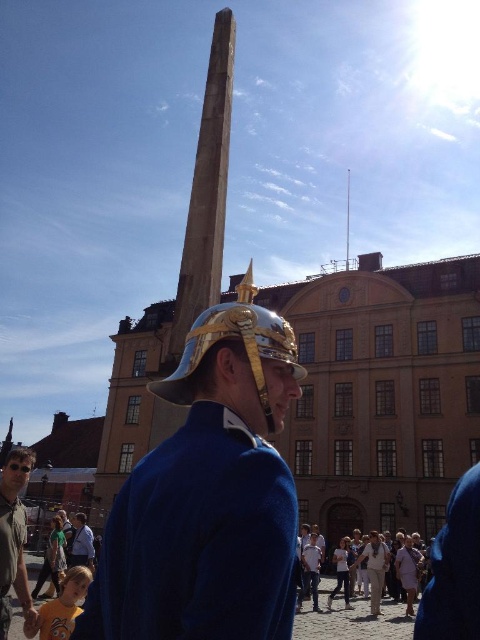
Question: Can you confirm if metallic helmet at center is bigger than matte gray shirt at lower left?

Choices:
 (A) no
 (B) yes

Answer: (A)

Question: Which object appears farthest from the camera in this image?

Choices:
 (A) matte gray shirt at lower left
 (B) metallic helmet at center

Answer: (A)

Question: Which point appears closest to the camera in this image?

Choices:
 (A) (250, 337)
 (B) (202, 324)

Answer: (A)

Question: In this image, where is metallic helmet at center located relative to matte gray shirt at lower left?

Choices:
 (A) above
 (B) below

Answer: (A)

Question: Which object is the farthest from the gold plated helmet at center?

Choices:
 (A) matte gray shirt at lower left
 (B) metallic helmet at center

Answer: (A)

Question: Can you confirm if metallic helmet at center is smaller than gold plated helmet at center?

Choices:
 (A) yes
 (B) no

Answer: (B)